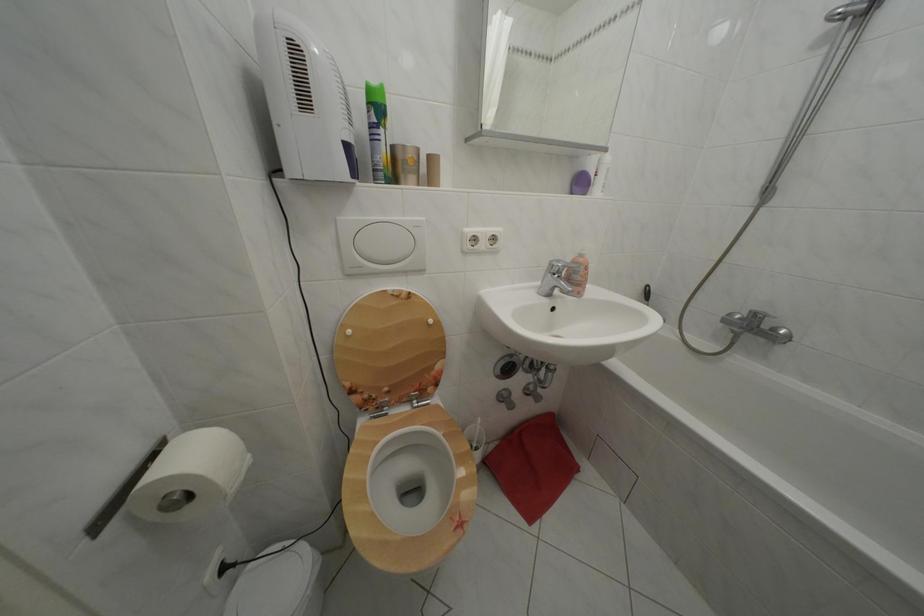
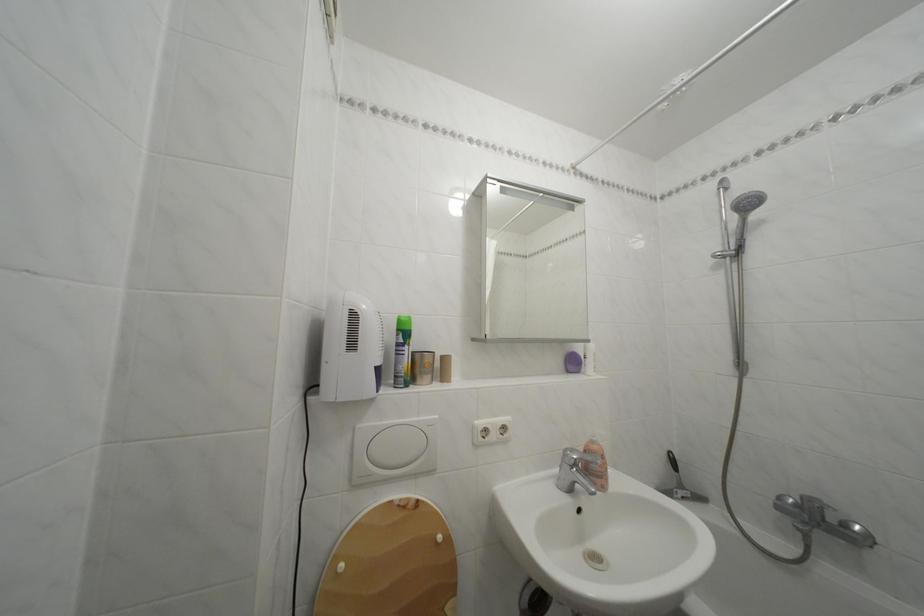
In the second image, find the point that corresponds to (590,262) in the first image.

(602, 448)